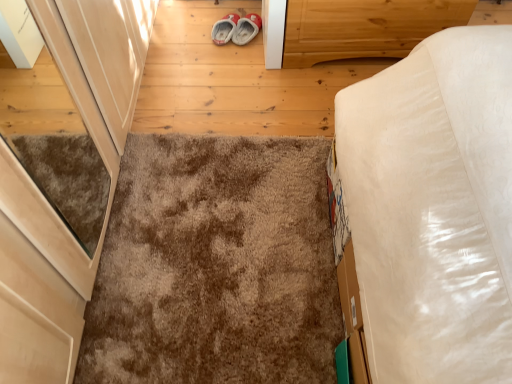
Question: Does light brown wood at upper right have a smaller size compared to brown shaggy carpet at center?

Choices:
 (A) yes
 (B) no

Answer: (B)

Question: Could you tell me if light brown wood at upper right is turned towards brown shaggy carpet at center?

Choices:
 (A) yes
 (B) no

Answer: (A)

Question: Can brown shaggy carpet at center be found inside light brown wood at upper right?

Choices:
 (A) no
 (B) yes

Answer: (A)

Question: Considering the relative sizes of light brown wood at upper right and brown shaggy carpet at center in the image provided, is light brown wood at upper right wider than brown shaggy carpet at center?

Choices:
 (A) yes
 (B) no

Answer: (B)

Question: From a real-world perspective, is light brown wood at upper right on top of brown shaggy carpet at center?

Choices:
 (A) yes
 (B) no

Answer: (A)

Question: Is light brown wood at upper right next to brown shaggy carpet at center and touching it?

Choices:
 (A) no
 (B) yes

Answer: (A)

Question: Can you confirm if brown shaggy carpet at center is shorter than light brown wood at upper right?

Choices:
 (A) yes
 (B) no

Answer: (A)

Question: Is brown shaggy carpet at center far away from light brown wood at upper right?

Choices:
 (A) no
 (B) yes

Answer: (A)

Question: From the image's perspective, is brown shaggy carpet at center over light brown wood at upper right?

Choices:
 (A) no
 (B) yes

Answer: (A)

Question: Is brown shaggy carpet at center oriented away from light brown wood at upper right?

Choices:
 (A) yes
 (B) no

Answer: (B)

Question: From a real-world perspective, is brown shaggy carpet at center positioned under light brown wood at upper right based on gravity?

Choices:
 (A) yes
 (B) no

Answer: (A)

Question: Considering the relative positions of brown shaggy carpet at center and light brown wood at upper right in the image provided, is brown shaggy carpet at center to the left of light brown wood at upper right from the viewer's perspective?

Choices:
 (A) yes
 (B) no

Answer: (A)

Question: Looking at their shapes, would you say brown shaggy carpet at center is wider or thinner than light brown wood at upper right?

Choices:
 (A) wide
 (B) thin

Answer: (A)